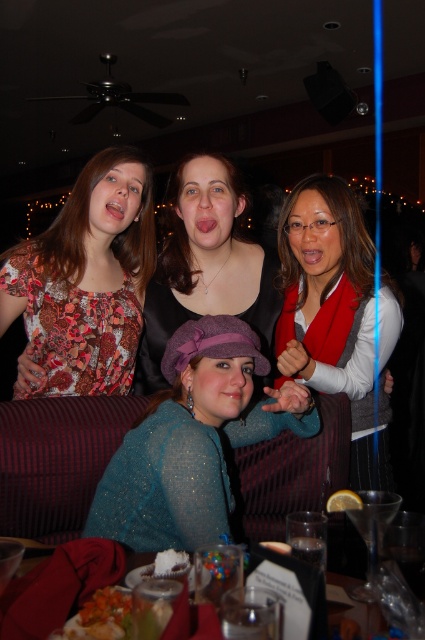
Is matte red scarf at center to the left of matte black top at center from the viewer's perspective?

Incorrect, matte red scarf at center is not on the left side of matte black top at center.

The image size is (425, 640). What do you see at coordinates (328, 305) in the screenshot?
I see `matte red scarf at center` at bounding box center [328, 305].

Where is `matte red scarf at center`? The width and height of the screenshot is (425, 640). matte red scarf at center is located at coordinates (328, 305).

Is sparkly teal sweater at center positioned at the back of matte black top at center?

No, it is not.

Does sparkly teal sweater at center appear on the right side of matte black top at center?

Indeed, sparkly teal sweater at center is positioned on the right side of matte black top at center.

Does point (217, 321) come behind point (201, 161)?

No, (217, 321) is in front of (201, 161).

Image resolution: width=425 pixels, height=640 pixels. Find the location of `sparkly teal sweater at center`. sparkly teal sweater at center is located at coordinates (193, 440).

Can you confirm if sparkly teal sweater at center is positioned to the right of matte red scarf at center?

No, sparkly teal sweater at center is not to the right of matte red scarf at center.

Between sparkly teal sweater at center and matte red scarf at center, which one has less height?

sparkly teal sweater at center

The height and width of the screenshot is (640, 425). What are the coordinates of `sparkly teal sweater at center` in the screenshot? It's located at (193, 440).